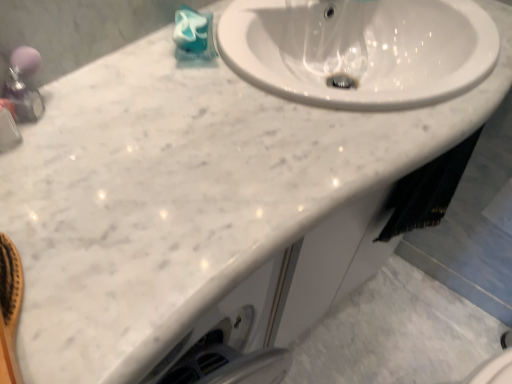
Locate an element on the screen. This screenshot has height=384, width=512. black cotton towel at lower right is located at coordinates (426, 191).

The image size is (512, 384). What do you see at coordinates (426, 191) in the screenshot?
I see `black cotton towel at lower right` at bounding box center [426, 191].

Where is `black cotton towel at lower right`? Image resolution: width=512 pixels, height=384 pixels. black cotton towel at lower right is located at coordinates (426, 191).